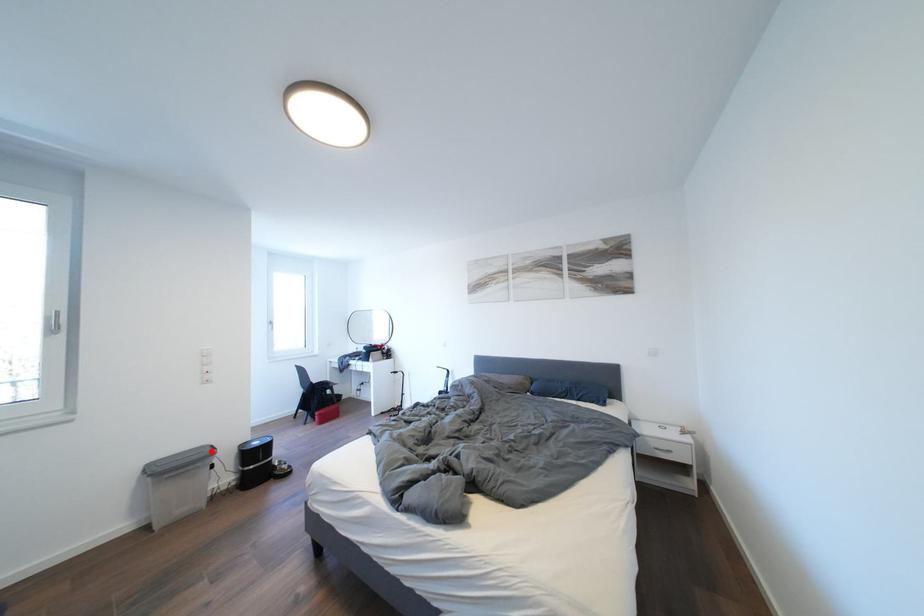
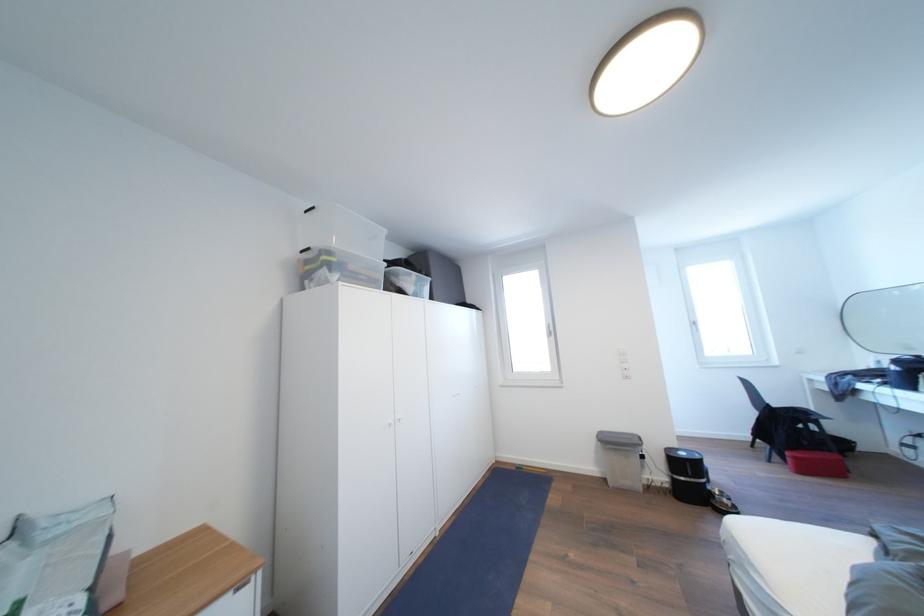
Question: A red point is marked in image1. In image2, is the corresponding 3D point closer to the camera or farther? Reply with the corresponding letter.

Choices:
 (A) The corresponding 3D point is closer.
 (B) The corresponding 3D point is farther.

Answer: (B)